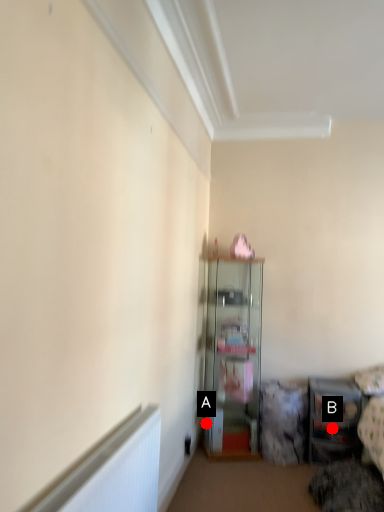
Question: Two points are circled on the image, labeled by A and B beside each circle. Which point is farther from the camera taking this photo?

Choices:
 (A) A is further
 (B) B is further

Answer: (A)